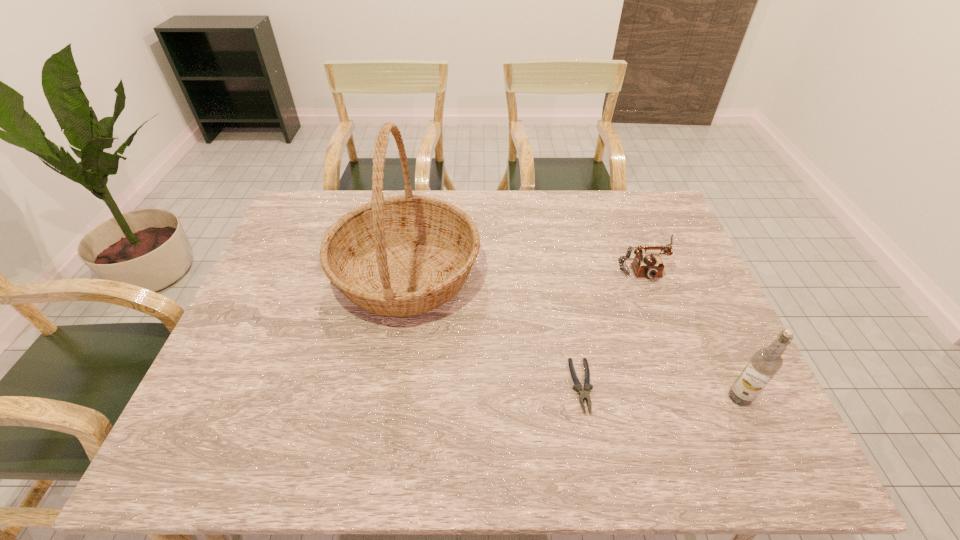
Locate an element on the screen. free location located 0.340m on the dial of the telephone is located at coordinates (701, 390).

The height and width of the screenshot is (540, 960). I want to click on object located in the far edge section of the desktop, so click(x=405, y=255).

The image size is (960, 540). In order to click on vodka located at the right edge in this screenshot , I will do `click(766, 362)`.

This screenshot has width=960, height=540. What are the coordinates of `telephone that is positioned at the right edge` in the screenshot? It's located at (651, 266).

Image resolution: width=960 pixels, height=540 pixels. I want to click on vacant area at the far edge, so click(x=468, y=211).

This screenshot has height=540, width=960. What are the coordinates of `free spot at the near edge of the desktop` in the screenshot? It's located at (412, 467).

Identify the location of vacant space at the left edge. The image size is (960, 540). (282, 309).

Identify the location of free point at the right edge. (657, 251).

In the image, there is a desktop. In order to click on vacant space at the far left corner in this screenshot , I will do `click(314, 234)`.

The width and height of the screenshot is (960, 540). Identify the location of free spot at the near left corner of the desktop. (239, 462).